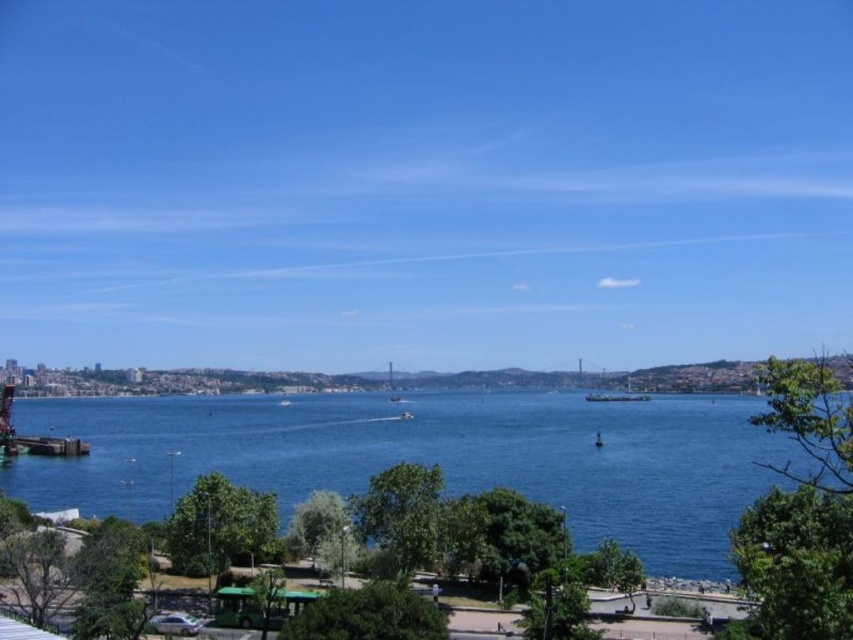
Does blue water at center appear under wooden dock at lower left?

Incorrect, blue water at center is not positioned below wooden dock at lower left.

Does blue water at center have a greater height compared to wooden dock at lower left?

Yes.

Who is more distant from viewer, (x=456, y=444) or (x=18, y=440)?

Positioned behind is point (x=18, y=440).

This screenshot has width=853, height=640. I want to click on blue water at center, so click(x=428, y=458).